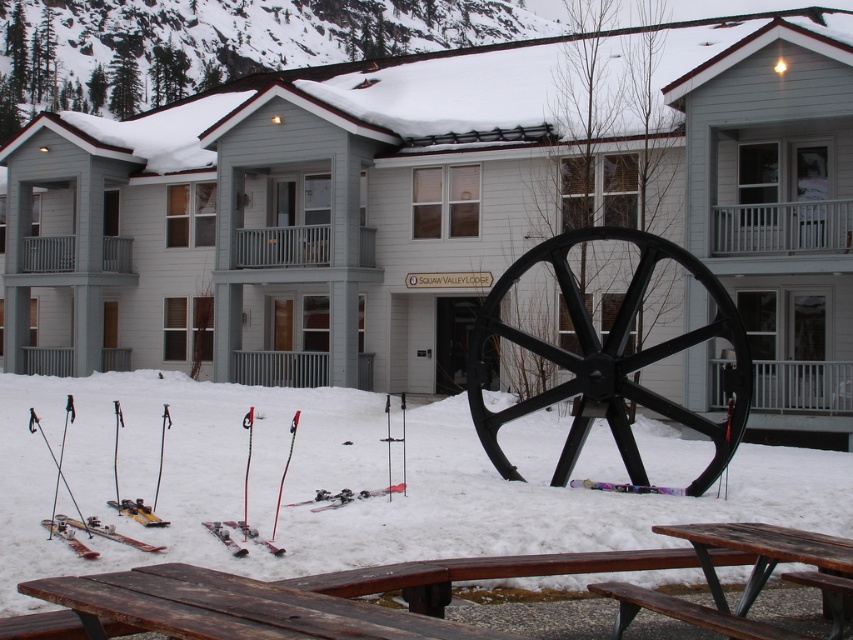
Based on the photo, you are standing at the base of Squaw Valley Lodge and see the dark brown wooden picnic table at lower center and the metallic skis at lower left. Which object is positioned more to the left?

The metallic skis at lower left are positioned more to the left compared to the dark brown wooden picnic table at lower center.

You are planning to place a small backpack on the dark brown wooden picnic table at lower center and the matte black skis at lower center. Which object has enough space to accommodate the backpack?

The dark brown wooden picnic table at lower center has a greater width than the matte black skis at lower center, so the backpack can be placed on the dark brown wooden picnic table at lower center.